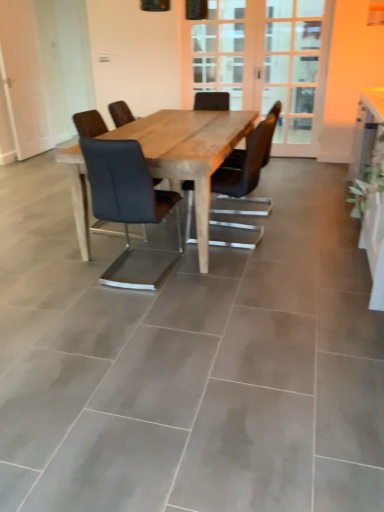
Question: Is wooden screen door at center, the second screen door positioned from the right, at the back of matte black chair at center, the second chair viewed from the left?

Choices:
 (A) no
 (B) yes

Answer: (A)

Question: Is matte black chair at center, the 1th chair positioned from the right, at the left side of wooden screen door at center, the second screen door positioned from the right?

Choices:
 (A) yes
 (B) no

Answer: (A)

Question: From a real-world perspective, does matte black chair at center, the second chair viewed from the left, stand above wooden screen door at center, which ranks as the 1th screen door in left-to-right order?

Choices:
 (A) yes
 (B) no

Answer: (B)

Question: Is matte black chair at center, the second chair viewed from the left, taller than wooden screen door at center, the second screen door positioned from the right?

Choices:
 (A) no
 (B) yes

Answer: (A)

Question: Is matte black chair at center, the 1th chair positioned from the right, next to wooden screen door at center, which ranks as the 1th screen door in left-to-right order, and touching it?

Choices:
 (A) yes
 (B) no

Answer: (B)

Question: Looking at their shapes, would you say matte black chair at center, the second chair viewed from the left, is wider or thinner than wooden screen door at center, the second screen door positioned from the right?

Choices:
 (A) thin
 (B) wide

Answer: (B)

Question: From the image's perspective, is matte black chair at center, the second chair viewed from the left, located above or below wooden screen door at center, the second screen door positioned from the right?

Choices:
 (A) below
 (B) above

Answer: (A)

Question: In the image, is matte black chair at center, the 1th chair positioned from the right, positioned in front of or behind wooden screen door at center, which ranks as the 1th screen door in left-to-right order?

Choices:
 (A) front
 (B) behind

Answer: (A)

Question: Is point (269, 128) closer or farther from the camera than point (259, 73)?

Choices:
 (A) closer
 (B) farther

Answer: (A)

Question: From their relative heights in the image, would you say green leafy plant at upper right is taller or shorter than white glossy computer desk at right?

Choices:
 (A) short
 (B) tall

Answer: (A)

Question: From the image's perspective, is green leafy plant at upper right positioned above or below white glossy computer desk at right?

Choices:
 (A) below
 (B) above

Answer: (B)

Question: In the image, is green leafy plant at upper right positioned in front of or behind white glossy computer desk at right?

Choices:
 (A) front
 (B) behind

Answer: (B)

Question: Looking at the image, does green leafy plant at upper right seem bigger or smaller compared to white glossy computer desk at right?

Choices:
 (A) big
 (B) small

Answer: (A)

Question: Considering the positions of wooden screen door at center, the second screen door positioned from the right, and matte black chair at center, the first chair viewed from the left, in the image, is wooden screen door at center, the second screen door positioned from the right, bigger or smaller than matte black chair at center, the first chair viewed from the left,?

Choices:
 (A) small
 (B) big

Answer: (B)

Question: Is wooden screen door at center, the second screen door positioned from the right, inside the boundaries of matte black chair at center, the second chair in the right-to-left sequence, or outside?

Choices:
 (A) inside
 (B) outside

Answer: (B)